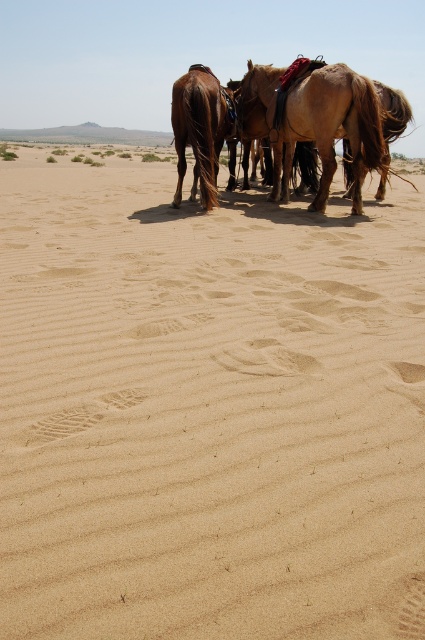
Question: Can you confirm if brown textured horse at center is positioned to the right of brown glossy horse at center?

Choices:
 (A) yes
 (B) no

Answer: (A)

Question: Is brown textured horse at center positioned before brown glossy horse at center?

Choices:
 (A) yes
 (B) no

Answer: (A)

Question: Does brown textured horse at center have a larger size compared to brown glossy horse at center?

Choices:
 (A) no
 (B) yes

Answer: (B)

Question: Which object is farther from the camera taking this photo?

Choices:
 (A) brown textured horse at center
 (B) brown glossy horse at center

Answer: (B)